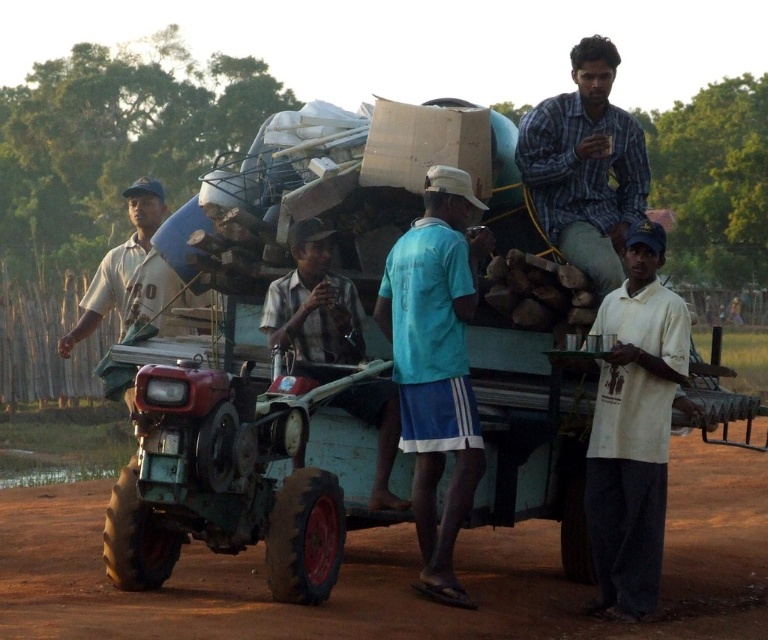
You are standing at the point marked as point (634, 428) and see the white cotton shirt at center. What is the nearest object to you?

The nearest object to you is the white cotton shirt at center located at point (634, 428).

You are a farmer preparing to load more items onto the trailer. You have a blue fabric shirt at center and a white cotton shirt at center. Which shirt should you choose if you need to cover a wider area on the trailer?

The blue fabric shirt at center has a larger width than the white cotton shirt at center, so you should choose the blue fabric shirt at center to cover a wider area on the trailer.